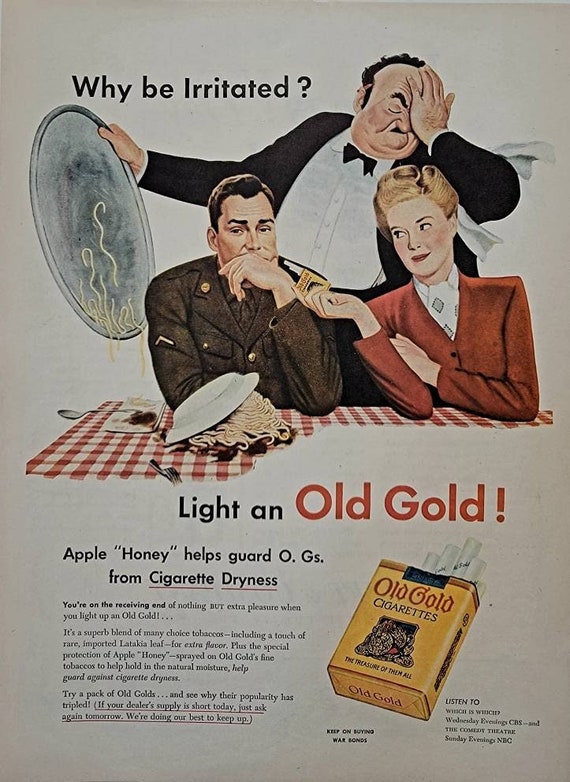
Identify the location of tines of fork pointing away from the people sitting at the table. The width and height of the screenshot is (570, 782). (170, 472).